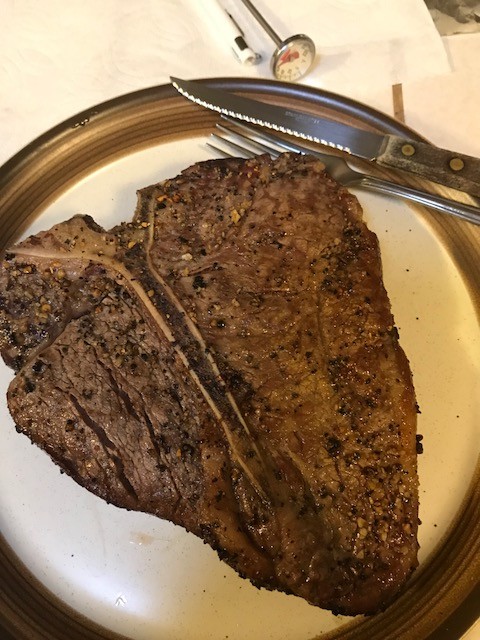
Find the location of a particular element. knife handle is located at coordinates (x=440, y=156).